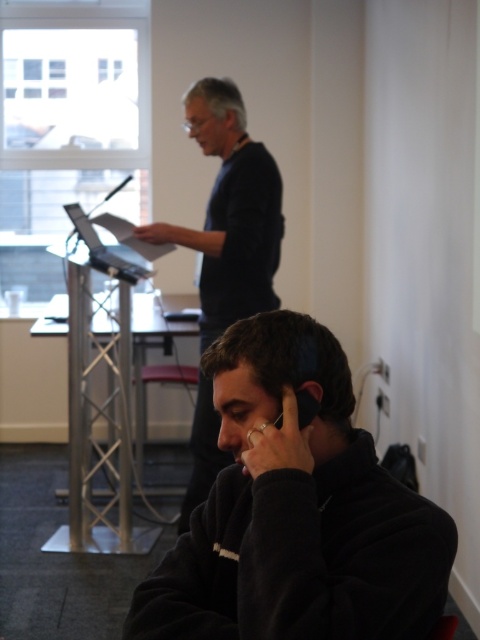
Is point (204, 516) in front of point (225, 99)?

Yes, it is in front of point (225, 99).

Which is above, black matte phone at lower center or dark blue sweater at center?

dark blue sweater at center

Image resolution: width=480 pixels, height=640 pixels. I want to click on black matte phone at lower center, so click(296, 512).

Locate an element on the screen. The width and height of the screenshot is (480, 640). black matte phone at lower center is located at coordinates (296, 512).